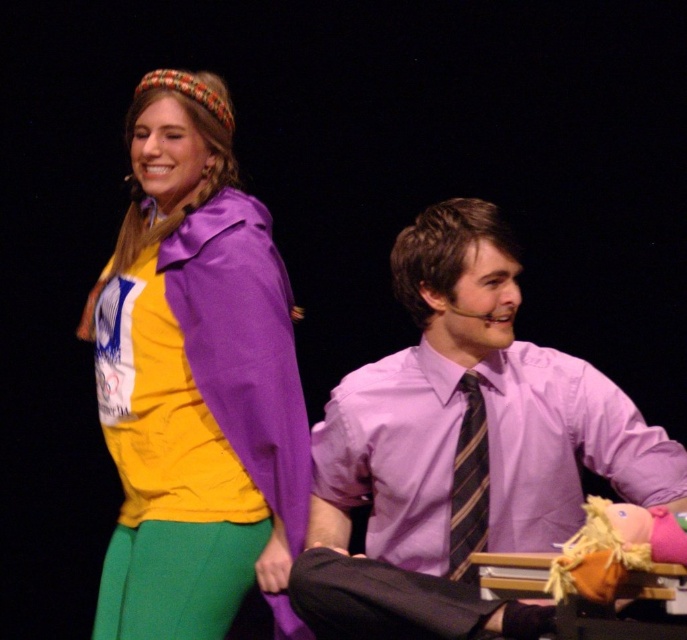
Does point (139, 285) come closer to viewer compared to point (675, 515)?

No, it is not.

Identify the location of matte purple jacket at upper left. (196, 349).

Is point (192, 140) positioned behind point (640, 547)?

That is True.

I want to click on matte purple jacket at upper left, so click(196, 349).

Does point (519, 451) come farther from viewer compared to point (106, 385)?

That is False.

How far apart are purple smooth shirt at center and matte purple jacket at upper left?

purple smooth shirt at center and matte purple jacket at upper left are 18.08 inches apart.

Who is more forward, (444,452) or (212,125)?

Point (444,452) is in front.

Identify the location of purple smooth shirt at center. The height and width of the screenshot is (640, 687). 460,445.

Which is below, purple smooth shirt at center or fluffy yellow puppet at lower right?

Positioned lower is fluffy yellow puppet at lower right.

Which is in front, point (486, 499) or point (633, 525)?

Point (633, 525)

Identify the location of purple smooth shirt at center. (460, 445).